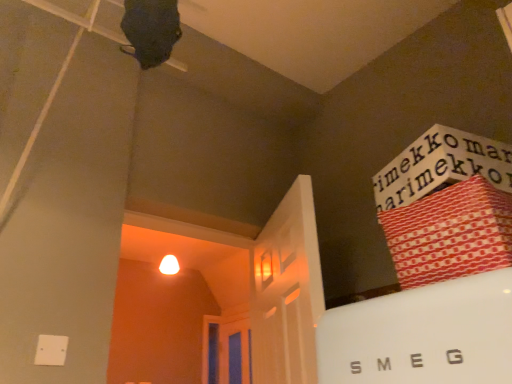
Question: Considering the positions of red paper bag at upper right and blue glass door at center in the image, is red paper bag at upper right bigger or smaller than blue glass door at center?

Choices:
 (A) small
 (B) big

Answer: (A)

Question: Is red paper bag at upper right inside or outside of blue glass door at center?

Choices:
 (A) outside
 (B) inside

Answer: (A)

Question: From a real-world perspective, is red paper bag at upper right positioned above or below blue glass door at center?

Choices:
 (A) below
 (B) above

Answer: (A)

Question: Relative to red paper bag at upper right, is blue glass door at center in front or behind?

Choices:
 (A) front
 (B) behind

Answer: (B)

Question: In terms of size, does blue glass door at center appear bigger or smaller than red paper bag at upper right?

Choices:
 (A) big
 (B) small

Answer: (A)

Question: Is blue glass door at center wider or thinner than red paper bag at upper right?

Choices:
 (A) wide
 (B) thin

Answer: (B)

Question: From the image's perspective, relative to red paper bag at upper right, is blue glass door at center above or below?

Choices:
 (A) above
 (B) below

Answer: (B)